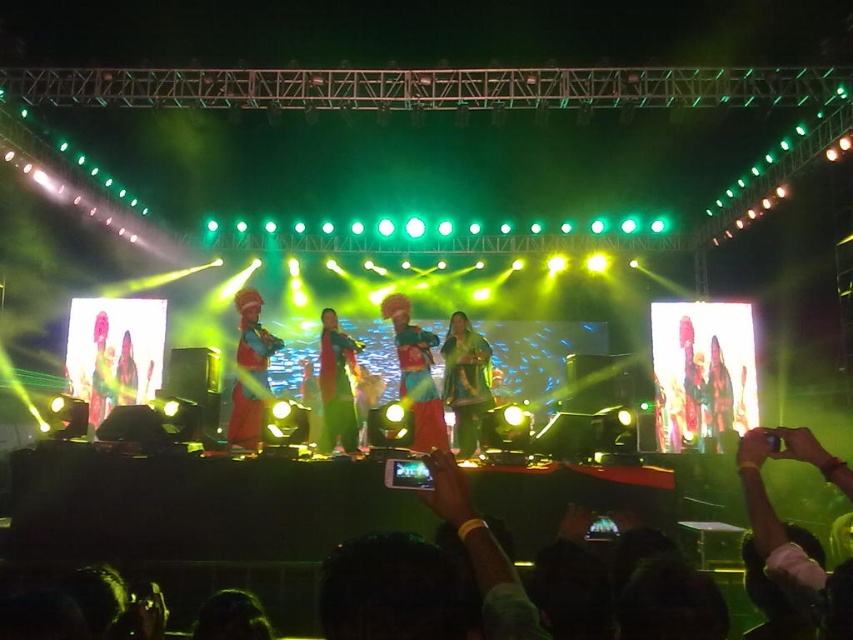
Who is shorter, green fabric dress at center or shiny green dress at center?

green fabric dress at center

Can you confirm if green fabric dress at center is shorter than shiny green dress at center?

Yes, green fabric dress at center is shorter than shiny green dress at center.

Locate an element on the screen. This screenshot has width=853, height=640. green fabric dress at center is located at coordinates (466, 381).

Does point (479, 384) lie behind point (235, 410)?

Yes.

Is point (450, 381) positioned behind point (247, 324)?

Yes.

Where is `green fabric dress at center`? This screenshot has height=640, width=853. green fabric dress at center is located at coordinates tap(466, 381).

How distant is shiny green fabric at center from shiny green dress at center?

shiny green fabric at center is 21.69 inches away from shiny green dress at center.

Can you confirm if shiny green fabric at center is shorter than shiny green dress at center?

Incorrect, shiny green fabric at center's height does not fall short of shiny green dress at center's.

Does point (428, 394) come in front of point (344, 410)?

Yes, it is.

Find the location of a particular element. Image resolution: width=853 pixels, height=640 pixels. shiny green fabric at center is located at coordinates (416, 376).